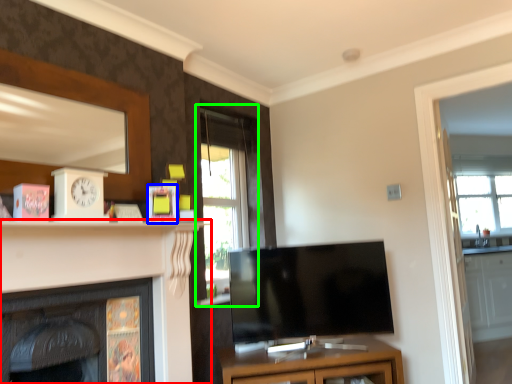
Question: Which is nearer to the fireplace (highlighted by a red box)? picture frame (highlighted by a blue box) or window (highlighted by a green box).

Choices:
 (A) picture frame
 (B) window

Answer: (A)